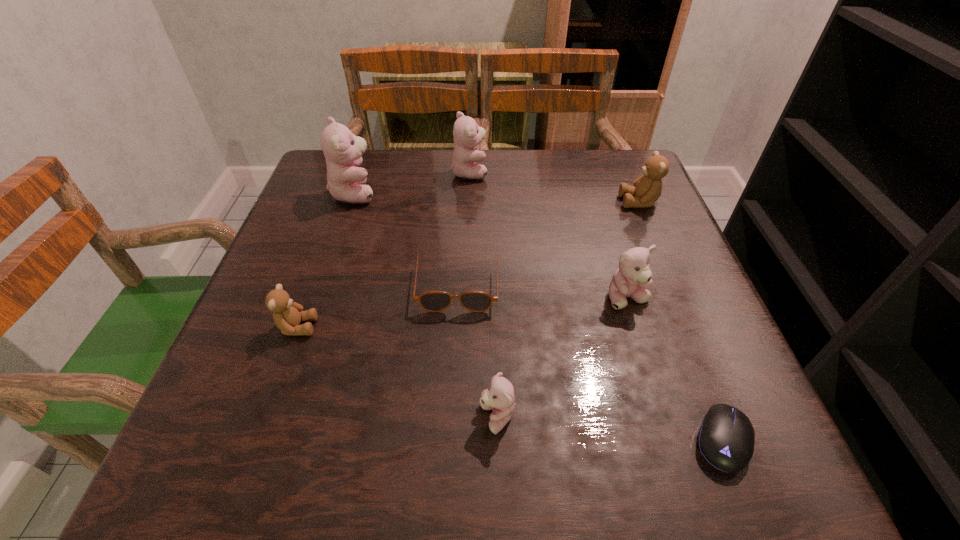
This screenshot has height=540, width=960. Identify the location of vacant space situated on the face of the farther brown teddy bear. point(472,202).

The width and height of the screenshot is (960, 540). What are the coordinates of `free space located 0.200m at the face of the second teddy bear from right to left` in the screenshot? It's located at (664, 416).

This screenshot has height=540, width=960. In order to click on vacant region located 0.140m on the face of the left brown teddy bear in this screenshot , I will do `click(395, 327)`.

Locate an element on the screen. The height and width of the screenshot is (540, 960). vacant point located 0.280m at the face of the nearest teddy bear is located at coordinates (294, 417).

Image resolution: width=960 pixels, height=540 pixels. I want to click on vacant region located at the face of the nearest teddy bear, so click(228, 417).

The width and height of the screenshot is (960, 540). Identify the location of vacant region located 0.200m at the face of the nearest teddy bear. (347, 417).

Find the location of `free point located 0.150m on the front-facing side of the sunglasses`. free point located 0.150m on the front-facing side of the sunglasses is located at coordinates (453, 386).

Locate an element on the screen. vacant position located 0.140m on the left of the computer mouse is located at coordinates (595, 440).

You are a GUI agent. You are given a task and a screenshot of the screen. Output one action in this format:
    pyautogui.click(x=<x>, y=<y>)
    Task: Click on the teddy bear that is at the near edge
    
    Given the screenshot: What is the action you would take?
    pyautogui.click(x=499, y=397)

Identify the location of computer mouse that is positioned at the near edge. The width and height of the screenshot is (960, 540). (726, 437).